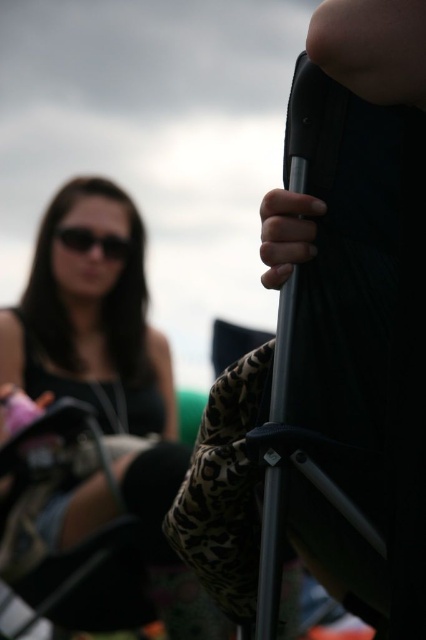
You are a photographer adjusting your camera settings to focus on the matte black tank top at left and the black matte sunglasses at upper left. Which object should you adjust your focus to first if you want to capture both clearly in the same shot?

The matte black tank top at left is much taller than the black matte sunglasses at upper left, so you should focus on the matte black tank top at left first to ensure both are in focus.

You are observing a group of people at an outdoor event. You notice two items on the left side of the frame. The first is a matte black tank top at left, and the second is black matte sunglasses at upper left. Which of these items is positioned higher in the image?

The black matte sunglasses at upper left are positioned higher than the matte black tank top at left.